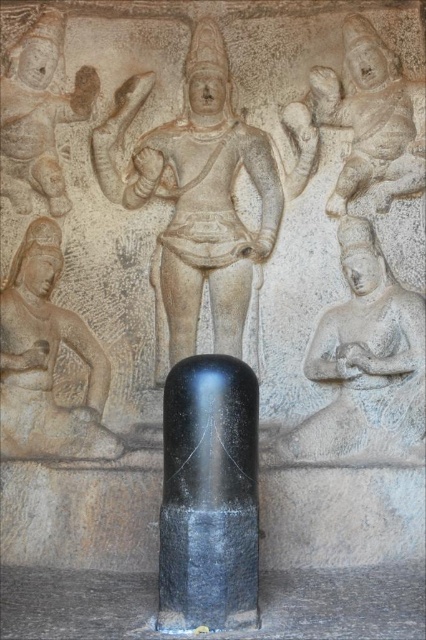
Who is more forward, (106, 429) or (351, 102)?

Point (106, 429)

Is point (69, 419) closer to camera compared to point (403, 99)?

Yes, point (69, 419) is in front of point (403, 99).

Which is in front, point (60, 440) or point (357, 74)?

Positioned in front is point (60, 440).

Locate an element on the screen. matte gray statue at lower left is located at coordinates click(46, 360).

Can you confirm if stone statue at center is shorter than gray stone carving at center?

In fact, stone statue at center may be taller than gray stone carving at center.

The image size is (426, 640). What are the coordinates of `stone statue at center` in the screenshot? It's located at (195, 198).

This screenshot has height=640, width=426. In order to click on stone statue at center in this screenshot , I will do 195,198.

Based on the photo, is black polished pillar at center positioned in front of gray stone figure at upper right?

That is True.

Describe the element at coordinates (209, 496) in the screenshot. Image resolution: width=426 pixels, height=640 pixels. I see `black polished pillar at center` at that location.

Measure the distance between point (169, 525) and camera.

Point (169, 525) is 1.86 meters away from camera.

Identify the location of black polished pillar at center. (209, 496).